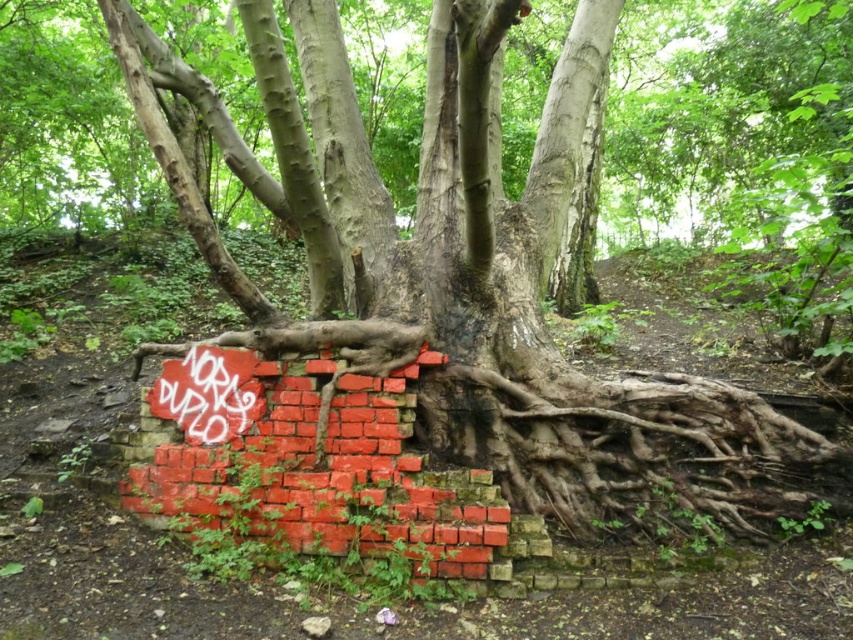
Which is more to the right, red brick wall at center or grungy graffiti at center?

Positioned to the right is red brick wall at center.

Can you confirm if red brick wall at center is thinner than grungy graffiti at center?

Incorrect, red brick wall at center's width is not less than grungy graffiti at center's.

Which is in front, point (312, 528) or point (193, 381)?

Point (312, 528) is more forward.

Find the location of a particular element. The height and width of the screenshot is (640, 853). red brick wall at center is located at coordinates [x=310, y=461].